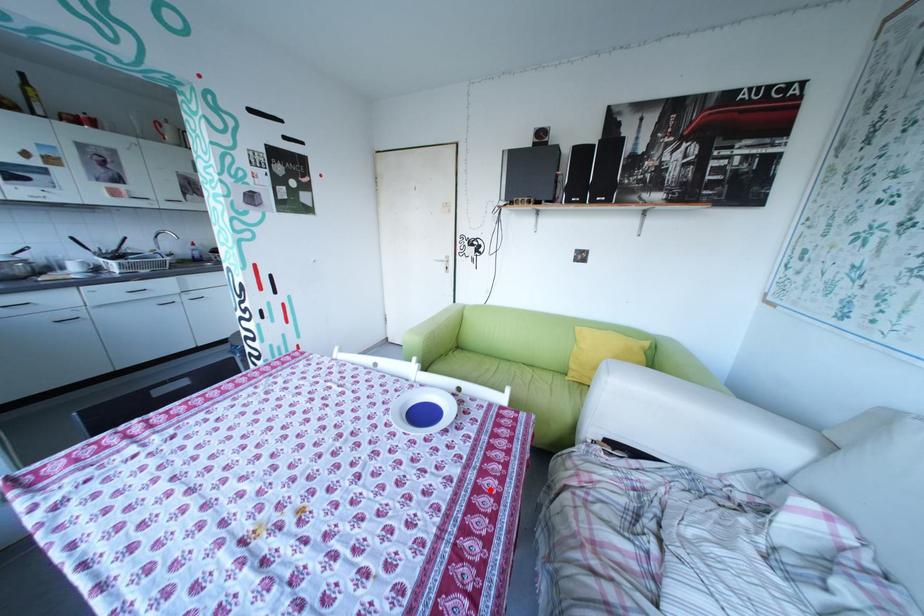
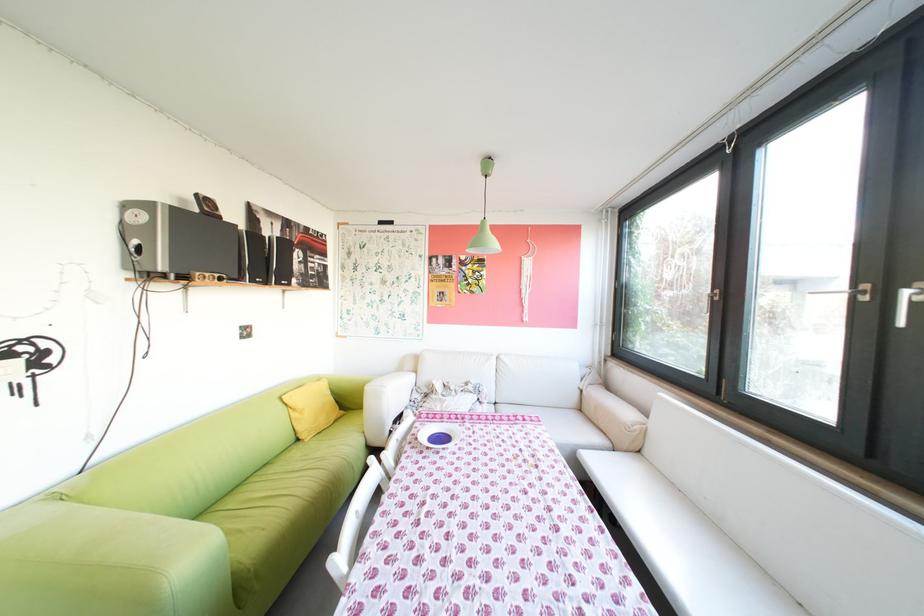
Locate, in the second image, the point that corresponds to the highlighted location in the first image.

(484, 419)